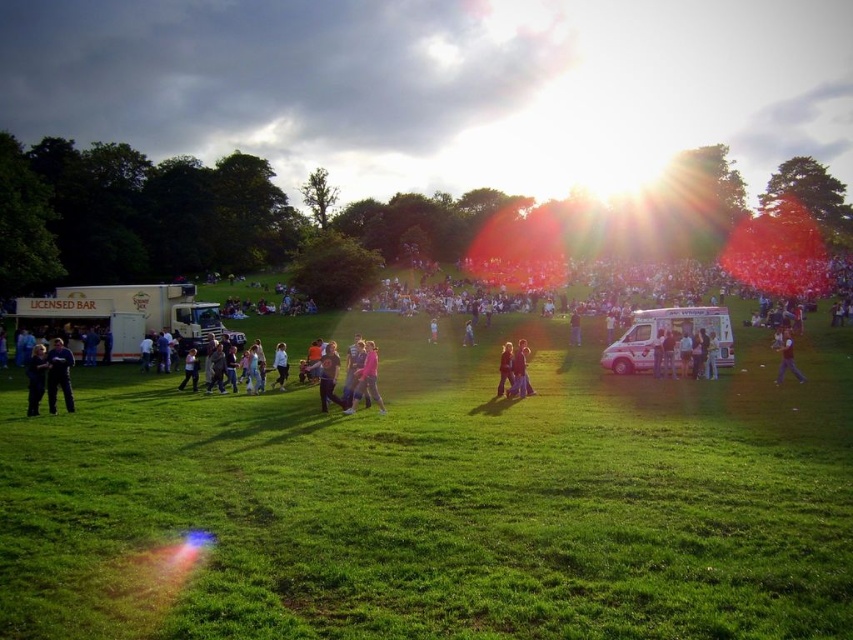
Question: Among these objects, which one is farthest from the camera?

Choices:
 (A) green grassy field at center
 (B) white metallic truck at left

Answer: (B)

Question: Does white metallic truck at left have a smaller size compared to black fabric jacket at lower left?

Choices:
 (A) no
 (B) yes

Answer: (A)

Question: Is green grassy field at center thinner than matte white van at center?

Choices:
 (A) yes
 (B) no

Answer: (A)

Question: Considering the relative positions of matte white van at center and pink fabric dress at center in the image provided, where is matte white van at center located with respect to pink fabric dress at center?

Choices:
 (A) right
 (B) left

Answer: (A)

Question: Which point is closer to the camera?

Choices:
 (A) dark blue jeans at lower right
 (B) dark blue jeans at lower left

Answer: (B)

Question: Which object appears closest to the camera in this image?

Choices:
 (A) white metallic truck at left
 (B) dark blue shirt at center
 (C) matte pink dress at center
 (D) green grassy field at center

Answer: (D)